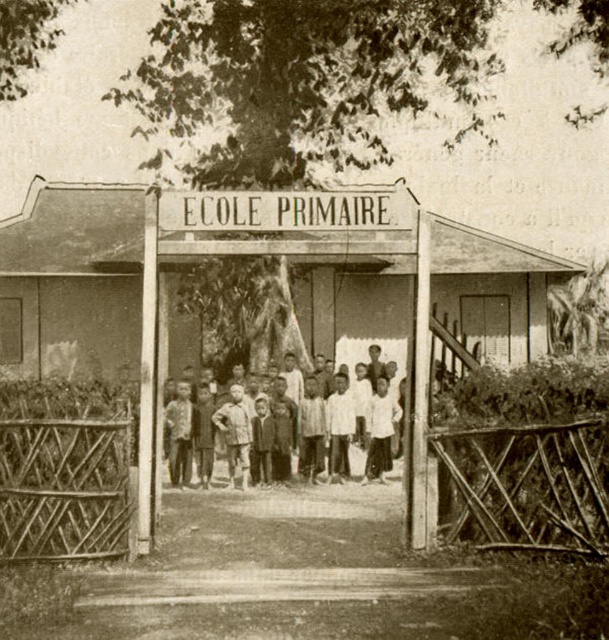
Question: Which object appears closest to the camera in this image?

Choices:
 (A) white cotton shirt at center
 (B) wooden sign at center

Answer: (B)

Question: Is wooden sign at center smaller than white cotton shirt at center?

Choices:
 (A) yes
 (B) no

Answer: (B)

Question: Is wooden sign at center closer to camera compared to white cotton shirt at center?

Choices:
 (A) yes
 (B) no

Answer: (A)

Question: Considering the relative positions of wooden sign at center and white cotton shirt at center in the image provided, where is wooden sign at center located with respect to white cotton shirt at center?

Choices:
 (A) below
 (B) above

Answer: (B)

Question: Among these points, which one is nearest to the camera?

Choices:
 (A) (311, 252)
 (B) (345, 403)

Answer: (A)